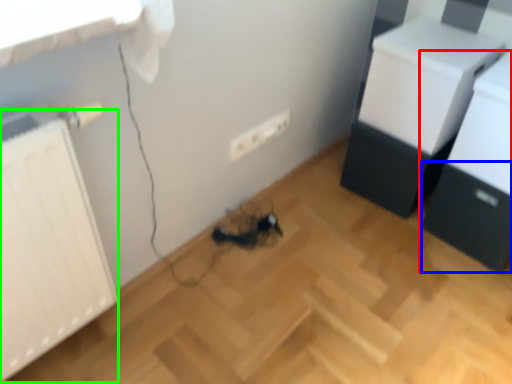
Question: Which object is positioned farthest from furniture (highlighted by a red box)? Select from drawer (highlighted by a blue box) and radiator (highlighted by a green box).

Choices:
 (A) drawer
 (B) radiator

Answer: (B)